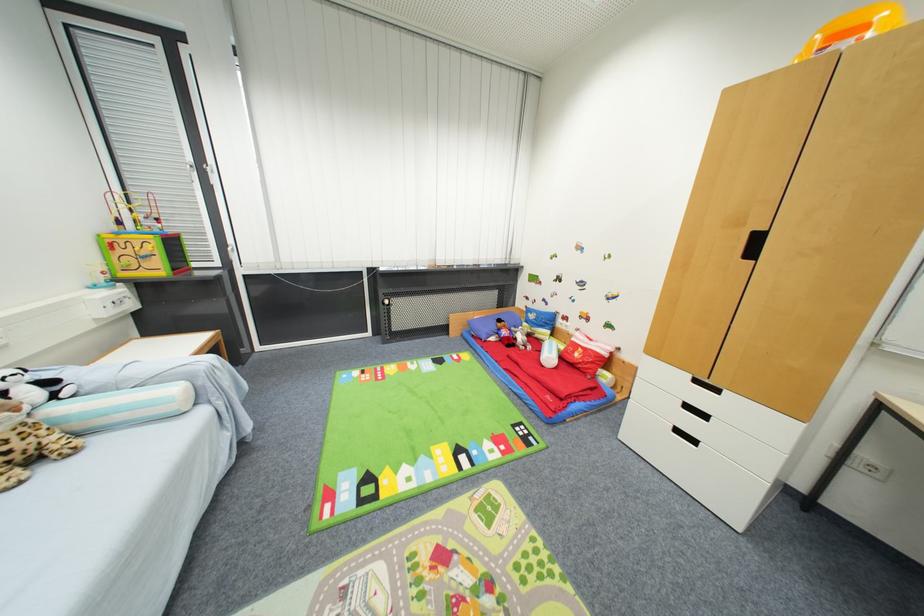
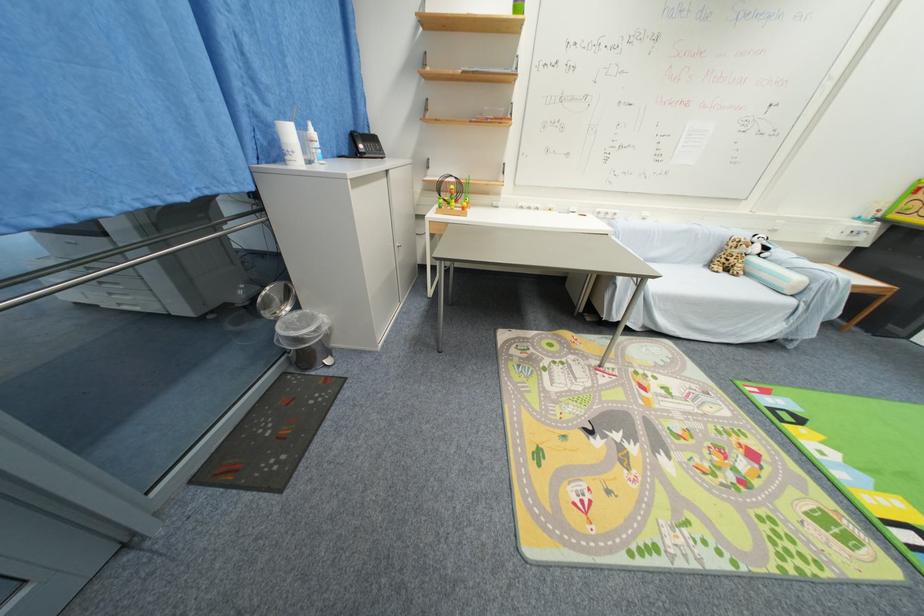
Locate, in the second image, the point that corresponds to point 38,395 in the first image.

(761, 251)